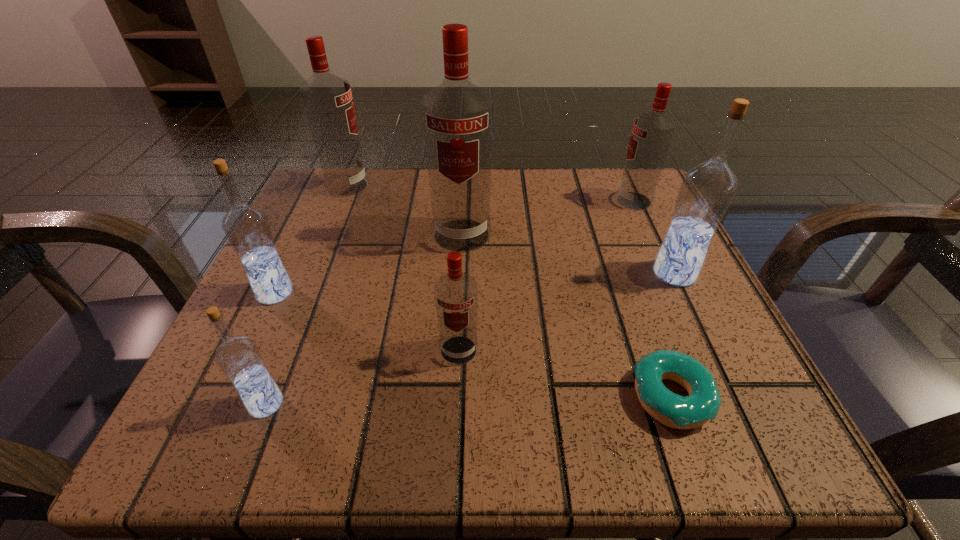
This screenshot has height=540, width=960. Find the location of `empty location between the sixth farthest vodka and the second smallest blue vodka`. empty location between the sixth farthest vodka and the second smallest blue vodka is located at coordinates (367, 321).

Where is `vacant space that's between the rightmost red vodka and the rightmost blue vodka`? Image resolution: width=960 pixels, height=540 pixels. vacant space that's between the rightmost red vodka and the rightmost blue vodka is located at coordinates (654, 237).

Identify which object is the sixth nearest to the biggest red vodka. Please provide its 2D coordinates. Your answer should be formatted as a tuple, i.e. [(x, y)], where the tuple contains the x and y coordinates of a point satisfying the conditions above.

[(703, 403)]

Identify which object is the nearest to the third biggest red vodka. Please provide its 2D coordinates. Your answer should be formatted as a tuple, i.e. [(x, y)], where the tuple contains the x and y coordinates of a point satisfying the conditions above.

[(707, 189)]

Point out which vodka is positioned as the nearest to the second biggest blue vodka. Please provide its 2D coordinates. Your answer should be formatted as a tuple, i.e. [(x, y)], where the tuple contains the x and y coordinates of a point satisfying the conditions above.

[(238, 357)]

Image resolution: width=960 pixels, height=540 pixels. What are the coordinates of `vodka that stands as the second closest to the second biggest blue vodka` in the screenshot? It's located at [x=457, y=116].

Identify which red vodka is the nearest to the biggest blue vodka. Please provide its 2D coordinates. Your answer should be formatted as a tuple, i.e. [(x, y)], where the tuple contains the x and y coordinates of a point satisfying the conditions above.

[(652, 132)]

Where is `red vodka that stands as the third closest to the second biggest blue vodka`? The height and width of the screenshot is (540, 960). red vodka that stands as the third closest to the second biggest blue vodka is located at coordinates (456, 293).

Where is `blue vodka that stands as the second closest to the leftmost blue vodka`? The height and width of the screenshot is (540, 960). blue vodka that stands as the second closest to the leftmost blue vodka is located at coordinates (707, 189).

Where is `blue vodka that stands as the closest to the shortest object`? blue vodka that stands as the closest to the shortest object is located at coordinates (707, 189).